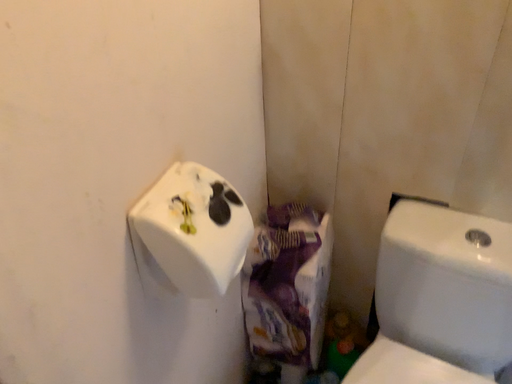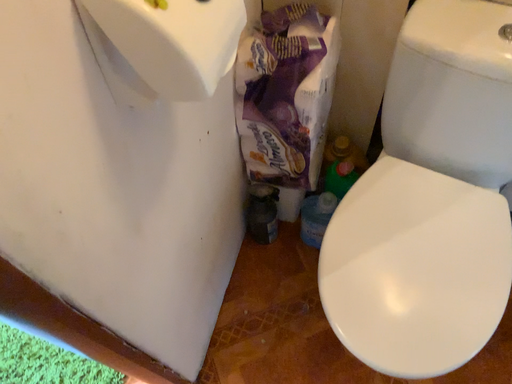
Question: Which way did the camera rotate in the video?

Choices:
 (A) rotated downward
 (B) rotated upward

Answer: (A)